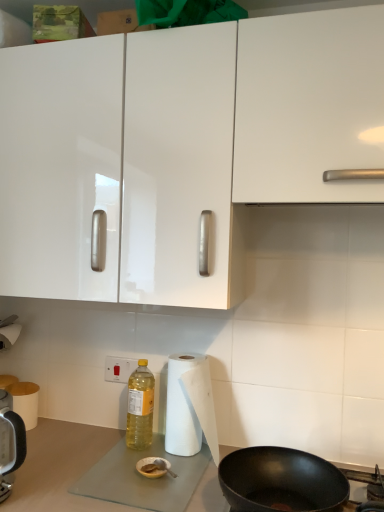
Question: Can you confirm if yellow translucent bottle at lower center is positioned to the left of white paper towel at lower left, the 2th paper towel in the front-to-back sequence?

Choices:
 (A) yes
 (B) no

Answer: (B)

Question: Is yellow translucent bottle at lower center looking in the opposite direction of white paper towel at lower left, the 2th paper towel in the front-to-back sequence?

Choices:
 (A) yes
 (B) no

Answer: (B)

Question: Can you confirm if yellow translucent bottle at lower center is shorter than white paper towel at lower left, arranged as the 2th paper towel when viewed from the right?

Choices:
 (A) no
 (B) yes

Answer: (A)

Question: Does yellow translucent bottle at lower center have a greater width compared to white paper towel at lower left, the 1th paper towel viewed from the back?

Choices:
 (A) yes
 (B) no

Answer: (B)

Question: Is yellow translucent bottle at lower center behind white paper towel at lower left, arranged as the 2th paper towel when viewed from the right?

Choices:
 (A) yes
 (B) no

Answer: (B)

Question: From the image's perspective, relative to white paper at lower center, which appears as the first paper towel when viewed from the right, is white paper towel at lower left, the 1th paper towel viewed from the back, above or below?

Choices:
 (A) above
 (B) below

Answer: (B)

Question: From a real-world perspective, is white paper towel at lower left, which is counted as the first paper towel, starting from the left, physically located above or below white paper at lower center, the 2th paper towel viewed from the back?

Choices:
 (A) above
 (B) below

Answer: (B)

Question: Relative to white paper at lower center, the 1th paper towel from the front, is white paper towel at lower left, arranged as the 2th paper towel when viewed from the right, in front or behind?

Choices:
 (A) front
 (B) behind

Answer: (B)

Question: Considering the positions of white paper towel at lower left, the 1th paper towel viewed from the back, and white paper at lower center, the 2th paper towel viewed from the back, in the image, is white paper towel at lower left, the 1th paper towel viewed from the back, taller or shorter than white paper at lower center, the 2th paper towel viewed from the back,?

Choices:
 (A) tall
 (B) short

Answer: (B)

Question: Considering the positions of white plastic electric outlet at lower center and yellow translucent bottle at lower center in the image, is white plastic electric outlet at lower center taller or shorter than yellow translucent bottle at lower center?

Choices:
 (A) short
 (B) tall

Answer: (A)

Question: In terms of width, does white plastic electric outlet at lower center look wider or thinner when compared to yellow translucent bottle at lower center?

Choices:
 (A) thin
 (B) wide

Answer: (A)

Question: Looking at the image, does white plastic electric outlet at lower center seem bigger or smaller compared to yellow translucent bottle at lower center?

Choices:
 (A) big
 (B) small

Answer: (B)

Question: Is white plastic electric outlet at lower center in front of or behind yellow translucent bottle at lower center in the image?

Choices:
 (A) front
 (B) behind

Answer: (B)

Question: From a real-world perspective, is yellow translucent bottle at lower center positioned above or below white glossy cabinet at upper center?

Choices:
 (A) below
 (B) above

Answer: (A)

Question: In terms of size, does yellow translucent bottle at lower center appear bigger or smaller than white glossy cabinet at upper center?

Choices:
 (A) small
 (B) big

Answer: (A)